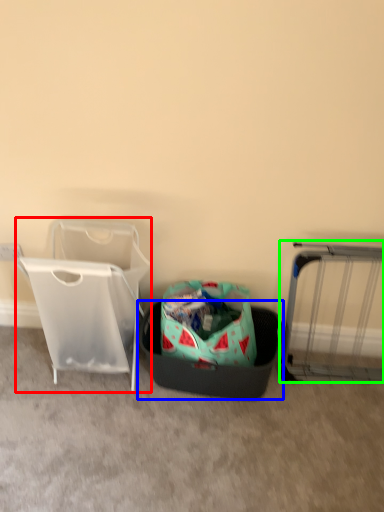
Question: Which object is positioned farthest from baby carriage (highlighted by a red box)? Select from laundry basket (highlighted by a blue box) and furniture (highlighted by a green box).

Choices:
 (A) laundry basket
 (B) furniture

Answer: (B)